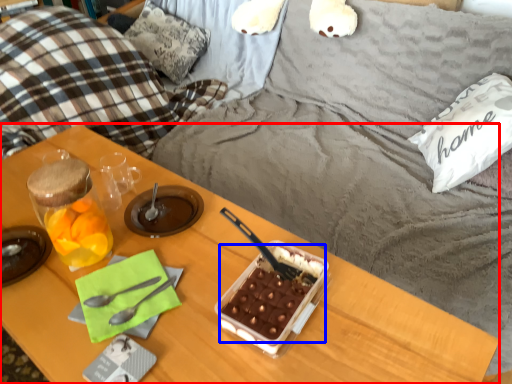
Question: Which object is further to the camera taking this photo, desk (highlighted by a red box) or snack (highlighted by a blue box)?

Choices:
 (A) desk
 (B) snack

Answer: (B)